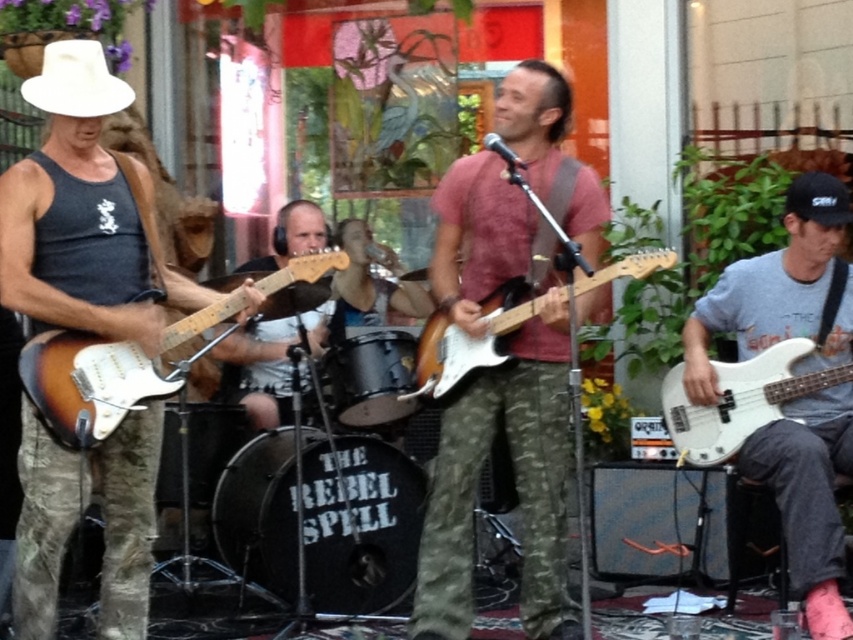
Based on the photo, you are standing in the crowd watching the band perform. There are two points marked in the image. One is at coordinate point (x=721, y=460) and the other is at point (x=62, y=68). Which point is closer to you?

Point (x=62, y=68) is closer to you because the description states that point (x=721, y=460) is further to the viewer than point (x=62, y=68).

You are a photographer setting up for the band photo shoot. You need to decide whether the white matte bass guitar at right will fit under a 1.2 meter high tent. The tent is placed where the white felt cowboy hat at upper left is currently. Based on their heights, will the bass guitar fit under the tent?

The white matte bass guitar at right is much taller than the white felt cowboy hat at upper left. Since the tent is placed where the hat is, and the bass guitar is taller, it may not fit under the 1.2 meter high tent. Measure the bass guitar height to confirm.